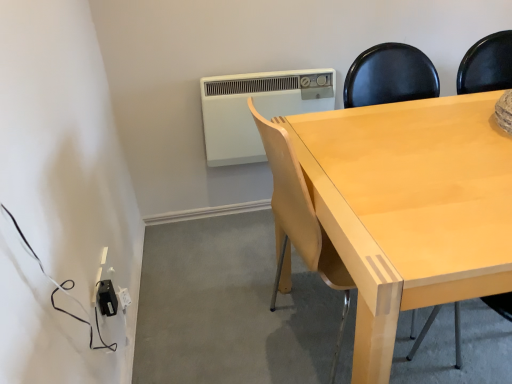
Question: From a real-world perspective, is light wood chair at center above or below black plastic outlet at lower left?

Choices:
 (A) below
 (B) above

Answer: (B)

Question: Considering the positions of light wood chair at center and black plastic outlet at lower left in the image, is light wood chair at center wider or thinner than black plastic outlet at lower left?

Choices:
 (A) wide
 (B) thin

Answer: (A)

Question: Estimate the real-world distances between objects in this image. Which object is closer to the white plastic air conditioner at upper center?

Choices:
 (A) black plastic outlet at lower left
 (B) light wood chair at center

Answer: (B)

Question: Estimate the real-world distances between objects in this image. Which object is closer to the white plastic air conditioner at upper center?

Choices:
 (A) black plastic outlet at lower left
 (B) light wood chair at center

Answer: (B)